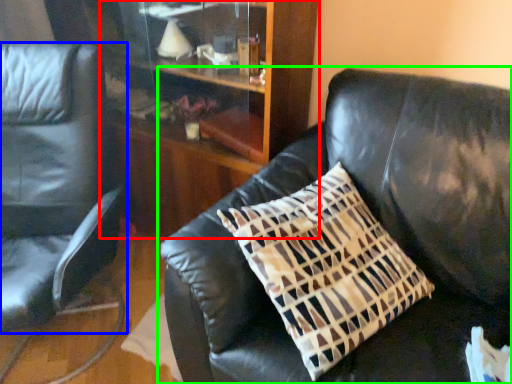
Question: Which object is the closest to the dresser (highlighted by a red box)? Choose among these: chair (highlighted by a blue box) or studio couch (highlighted by a green box).

Choices:
 (A) chair
 (B) studio couch

Answer: (B)